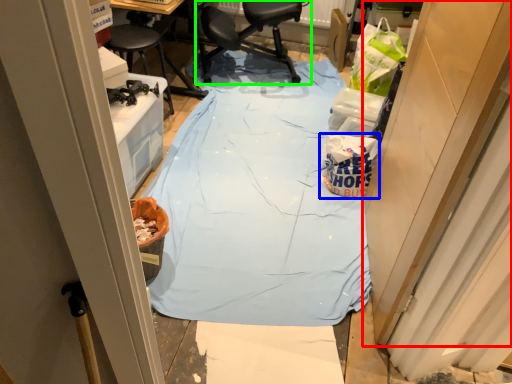
Question: Based on their relative distances, which object is nearer to door (highlighted by a red box)? Choose from waste (highlighted by a blue box) and chair (highlighted by a green box).

Choices:
 (A) waste
 (B) chair

Answer: (A)